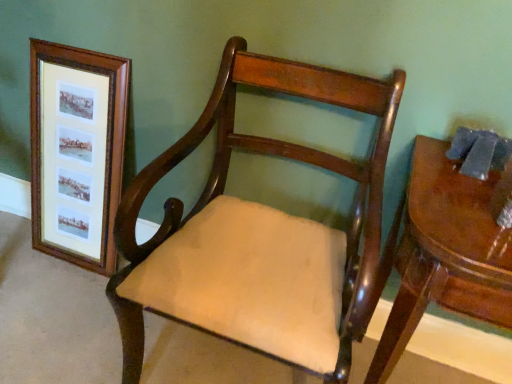
Question: From the image's perspective, would you say mahogany wood chair at center is positioned over wooden frame at left?

Choices:
 (A) no
 (B) yes

Answer: (A)

Question: Can you confirm if mahogany wood chair at center is wider than wooden frame at left?

Choices:
 (A) no
 (B) yes

Answer: (B)

Question: Is mahogany wood chair at center oriented towards wooden frame at left?

Choices:
 (A) no
 (B) yes

Answer: (A)

Question: Considering the relative positions of mahogany wood chair at center and wooden frame at left in the image provided, is mahogany wood chair at center to the left of wooden frame at left from the viewer's perspective?

Choices:
 (A) yes
 (B) no

Answer: (B)

Question: Can wooden frame at left be found inside mahogany wood chair at center?

Choices:
 (A) no
 (B) yes

Answer: (A)

Question: Considering the positions of wooden frame at left and glossy wood table at right in the image, is wooden frame at left taller or shorter than glossy wood table at right?

Choices:
 (A) tall
 (B) short

Answer: (A)

Question: Looking at their shapes, would you say wooden frame at left is wider or thinner than glossy wood table at right?

Choices:
 (A) thin
 (B) wide

Answer: (A)

Question: Is wooden frame at left inside or outside of glossy wood table at right?

Choices:
 (A) outside
 (B) inside

Answer: (A)

Question: In terms of size, does wooden frame at left appear bigger or smaller than glossy wood table at right?

Choices:
 (A) big
 (B) small

Answer: (B)

Question: From a real-world perspective, is mahogany wood chair at center positioned above or below glossy wood table at right?

Choices:
 (A) above
 (B) below

Answer: (A)

Question: In terms of height, does mahogany wood chair at center look taller or shorter compared to glossy wood table at right?

Choices:
 (A) short
 (B) tall

Answer: (B)

Question: Based on their positions, is mahogany wood chair at center located to the left or right of glossy wood table at right?

Choices:
 (A) left
 (B) right

Answer: (A)

Question: Does point (292, 332) appear closer or farther from the camera than point (485, 317)?

Choices:
 (A) closer
 (B) farther

Answer: (B)

Question: Would you say wooden frame at left is inside or outside mahogany wood chair at center?

Choices:
 (A) outside
 (B) inside

Answer: (A)

Question: Is point (103, 152) closer or farther from the camera than point (327, 276)?

Choices:
 (A) farther
 (B) closer

Answer: (A)